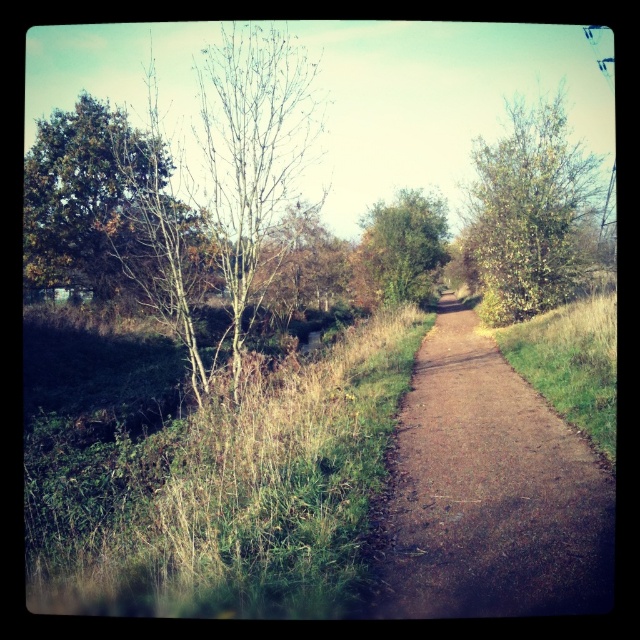
Question: Can you confirm if green grass at right is positioned below green leafy tree at center?

Choices:
 (A) yes
 (B) no

Answer: (A)

Question: Is brown gravel path at center below green leafy tree at left?

Choices:
 (A) no
 (B) yes

Answer: (B)

Question: Can you confirm if green leafy tree at upper right is positioned to the right of green leafy tree at center?

Choices:
 (A) no
 (B) yes

Answer: (B)

Question: Which point is farther from the camera taking this photo?

Choices:
 (A) (468, 490)
 (B) (548, 304)
 (C) (429, 292)
 (D) (84, 156)

Answer: (C)

Question: Based on their relative distances, which object is nearer to the green grass at right?

Choices:
 (A) green grass at left
 (B) green leafy tree at center
 (C) brown gravel path at center

Answer: (C)

Question: Based on their relative distances, which object is farther from the green leafy tree at left?

Choices:
 (A) green grass at left
 (B) brown gravel path at center
 (C) green leafy tree at upper right

Answer: (C)